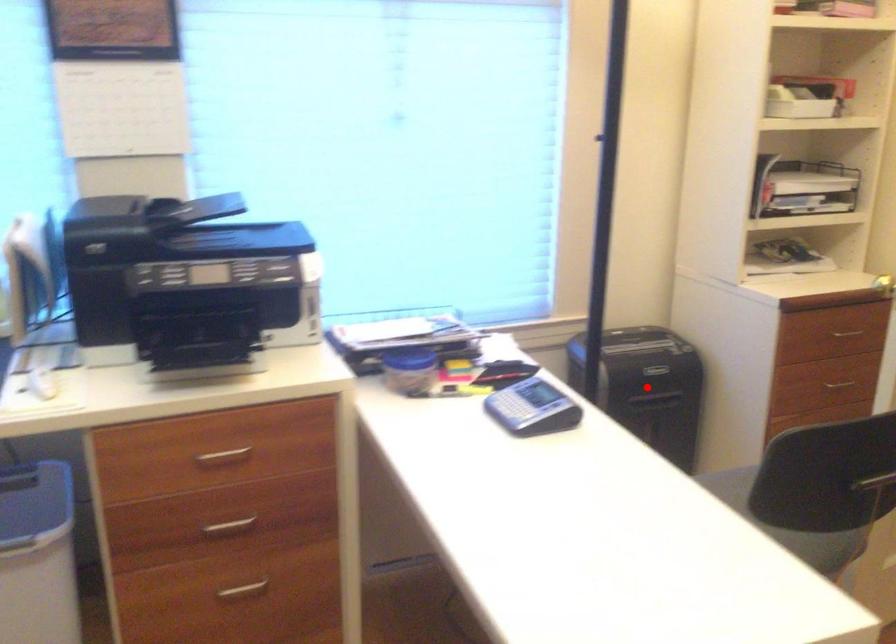
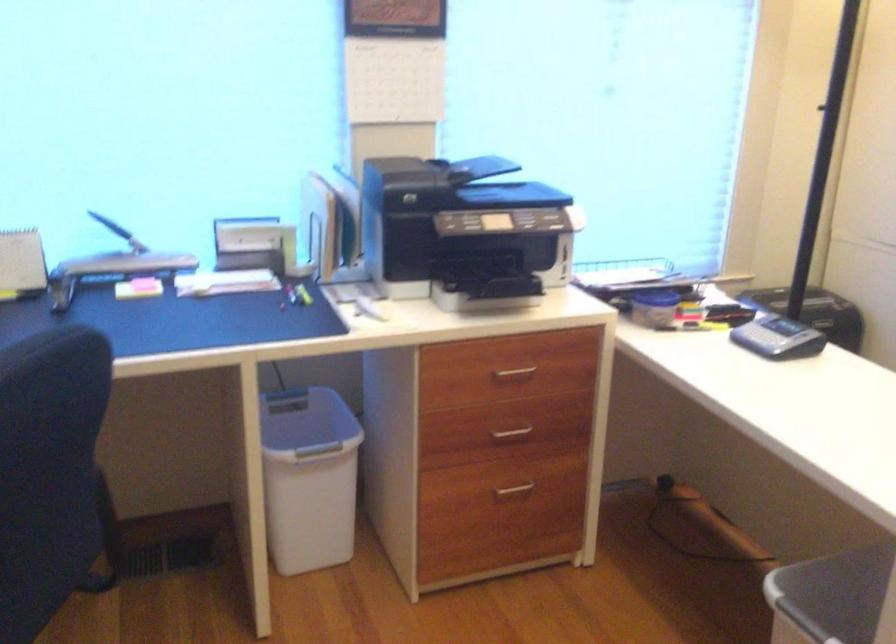
Question: I am providing you with two images of the same scene from different viewpoints. A red point is marked on the first image. Can you still see the location of the red point in image 2?

Choices:
 (A) Yes
 (B) No

Answer: (B)